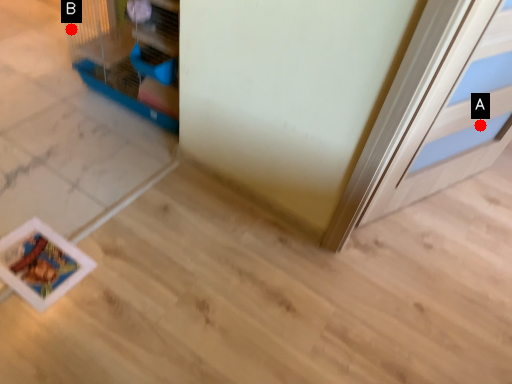
Question: Two points are circled on the image, labeled by A and B beside each circle. Which point is closer to the camera?

Choices:
 (A) A is closer
 (B) B is closer

Answer: (A)